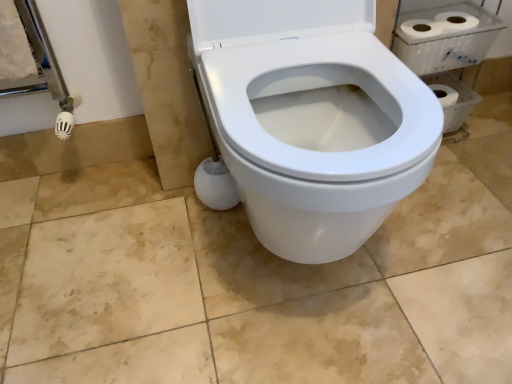
At what (x,y) coordinates should I click in order to perform the action: click on white glossy toilet at center. Please return your answer as a coordinate pair (x, y). Looking at the image, I should click on coord(312,119).

Describe the element at coordinates (312, 119) in the screenshot. This screenshot has width=512, height=384. I see `white glossy toilet at center` at that location.

Where is `white glossy toilet at center`? The width and height of the screenshot is (512, 384). white glossy toilet at center is located at coordinates (312, 119).